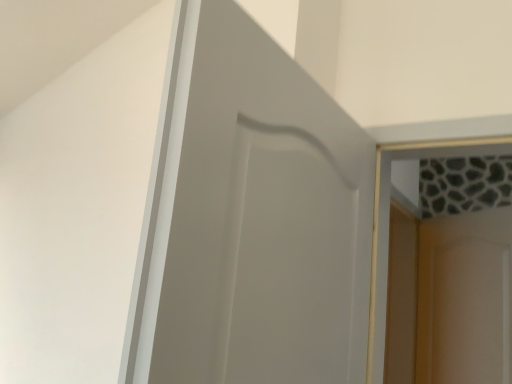
Question: Can you confirm if matte white door at center is smaller than white glossy screen door at upper right?

Choices:
 (A) no
 (B) yes

Answer: (A)

Question: Are matte white door at center and white glossy screen door at upper right beside each other?

Choices:
 (A) yes
 (B) no

Answer: (B)

Question: Is matte white door at center facing away from white glossy screen door at upper right?

Choices:
 (A) no
 (B) yes

Answer: (A)

Question: Is matte white door at center at the left side of white glossy screen door at upper right?

Choices:
 (A) yes
 (B) no

Answer: (A)

Question: Does matte white door at center turn towards white glossy screen door at upper right?

Choices:
 (A) no
 (B) yes

Answer: (A)

Question: Is matte white door at center thinner than white glossy screen door at upper right?

Choices:
 (A) yes
 (B) no

Answer: (B)

Question: Is the position of white glossy screen door at upper right less distant than that of matte white door at center?

Choices:
 (A) no
 (B) yes

Answer: (A)

Question: From the image's perspective, is white glossy screen door at upper right below matte white door at center?

Choices:
 (A) yes
 (B) no

Answer: (A)

Question: Is white glossy screen door at upper right smaller than matte white door at center?

Choices:
 (A) no
 (B) yes

Answer: (B)

Question: Does white glossy screen door at upper right have a larger size compared to matte white door at center?

Choices:
 (A) yes
 (B) no

Answer: (B)

Question: Is white glossy screen door at upper right facing away from matte white door at center?

Choices:
 (A) yes
 (B) no

Answer: (B)

Question: Is white glossy screen door at upper right positioned beyond the bounds of matte white door at center?

Choices:
 (A) no
 (B) yes

Answer: (B)

Question: Considering the positions of point (189, 29) and point (452, 241), is point (189, 29) closer or farther from the camera than point (452, 241)?

Choices:
 (A) farther
 (B) closer

Answer: (B)